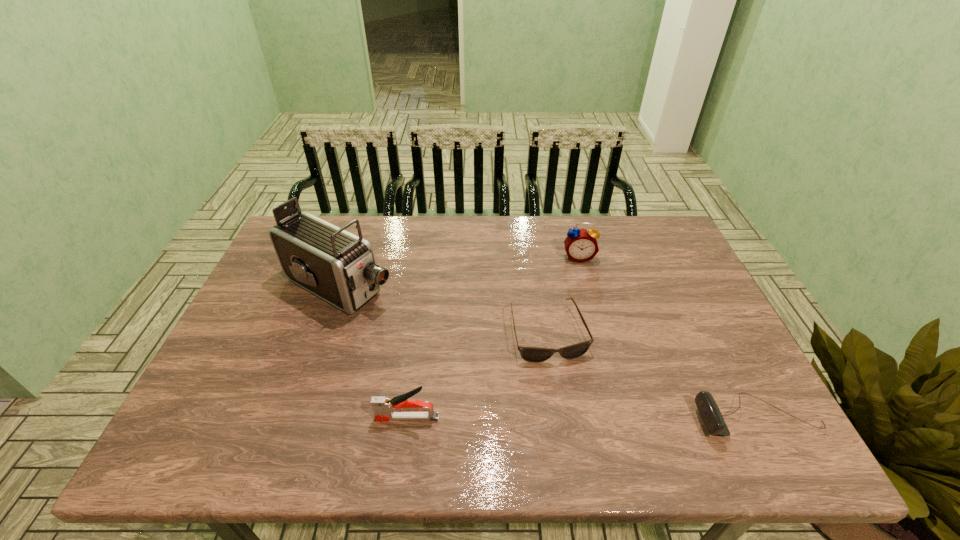
Where is `the fourth object from right to left`? Image resolution: width=960 pixels, height=540 pixels. the fourth object from right to left is located at coordinates (385, 409).

Find the location of `the third tallest object`. the third tallest object is located at coordinates (385, 409).

Locate an element on the screen. Image resolution: width=960 pixels, height=540 pixels. the second shortest object is located at coordinates (709, 412).

I want to click on the rightmost object, so click(x=709, y=412).

What are the coordinates of `sunglasses` in the screenshot? It's located at (530, 354).

Image resolution: width=960 pixels, height=540 pixels. I want to click on alarm clock, so click(x=581, y=245).

Image resolution: width=960 pixels, height=540 pixels. Identify the location of the tallest object. (339, 267).

Locate an element on the screen. This screenshot has width=960, height=540. the leftmost object is located at coordinates coord(339,267).

Find the location of `free spot located 0.320m on the handle side of the fourth object from right to left`. free spot located 0.320m on the handle side of the fourth object from right to left is located at coordinates (230, 417).

Where is `free space located on the handle side of the fourth object from right to left`? This screenshot has width=960, height=540. free space located on the handle side of the fourth object from right to left is located at coordinates (267, 417).